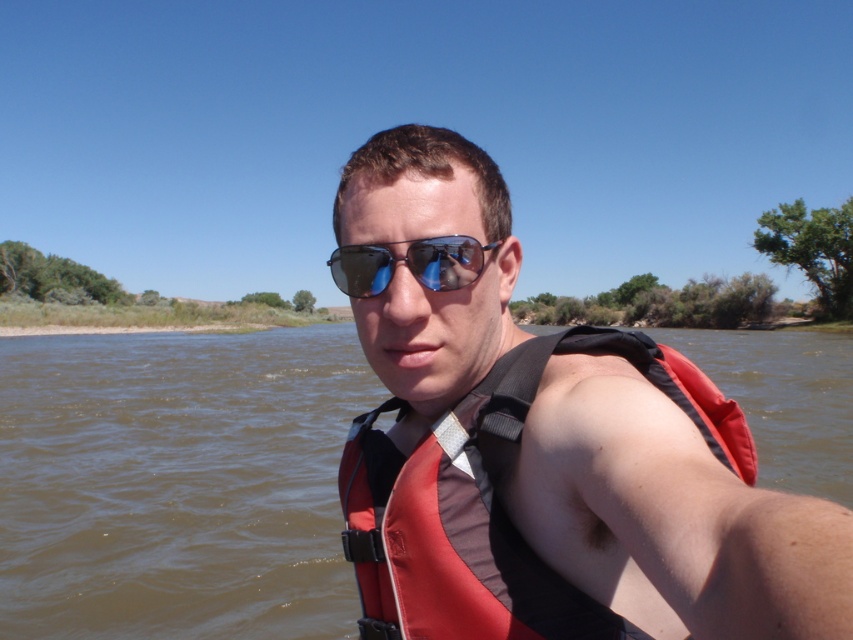
You are a photographer positioned 20 inches away from the matte red life vest at center. Can you adjust your position to get a closer shot without moving the life vest? Explain based on the current distance.

The matte red life vest at center is currently 19.37 inches away from the viewer. Since you are positioned 20 inches away, you can move slightly closer to reduce the distance to within 19.37 inches for a closer shot.

You are a photographer trying to capture the perfect shot of the person in the scene. Since the matte red life vest at center and the blue reflective lenses at center are both at the center, which object would appear larger in your photo?

The matte red life vest at center is taller than blue reflective lenses at center, so it would appear larger in the photo.

You are a safety inspector checking the scene. The brown matte water at center and the blue reflective lenses at center are both at the center. Which object is closer to the observer?

The brown matte water at center is positioned over blue reflective lenses at center, meaning it is closer to the observer.